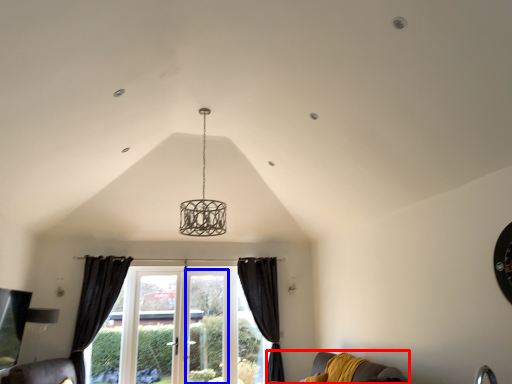
Question: Which of the following is the closest to the observer, couch (highlighted by a red box) or screen door (highlighted by a blue box)?

Choices:
 (A) couch
 (B) screen door

Answer: (A)